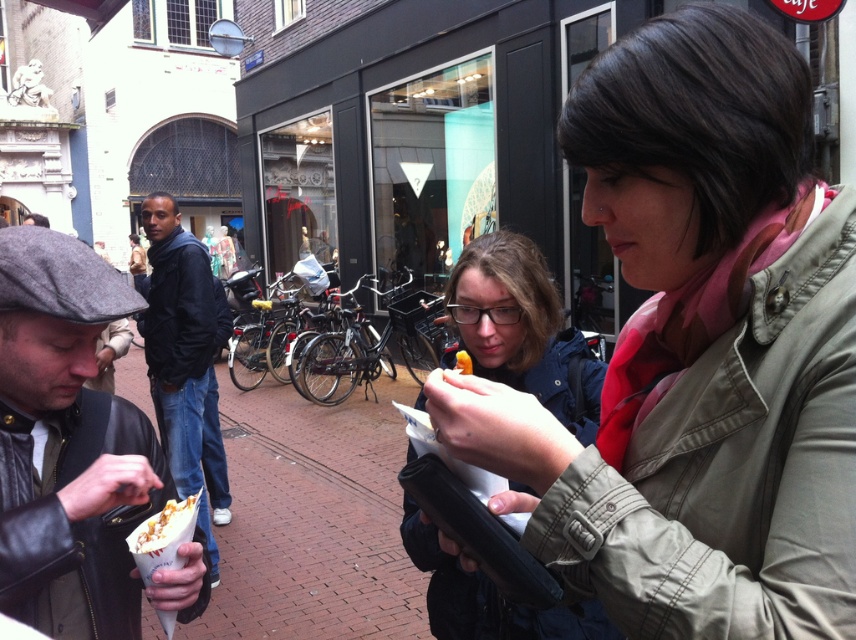
You are standing in the street scene and want to walk from point A to point B. Point A is at coordinate point (462, 593) and point B is at coordinate point (462, 364). Which point should you start walking from to reach the other point without moving backward?

You should start walking from point A at coordinate point (462, 593) because it is closer to you than point B at coordinate point (462, 364). Since point A is further to the viewer, starting there allows you to move forward towards point B without needing to go backward.

You are standing in the street scene and want to pick up the item at point [409,556] and the item at point [163,401]. Which item will you reach first if you move forward in a straight line?

You will reach the item at point [409,556] first because it is closer to you than the item at point [163,401].